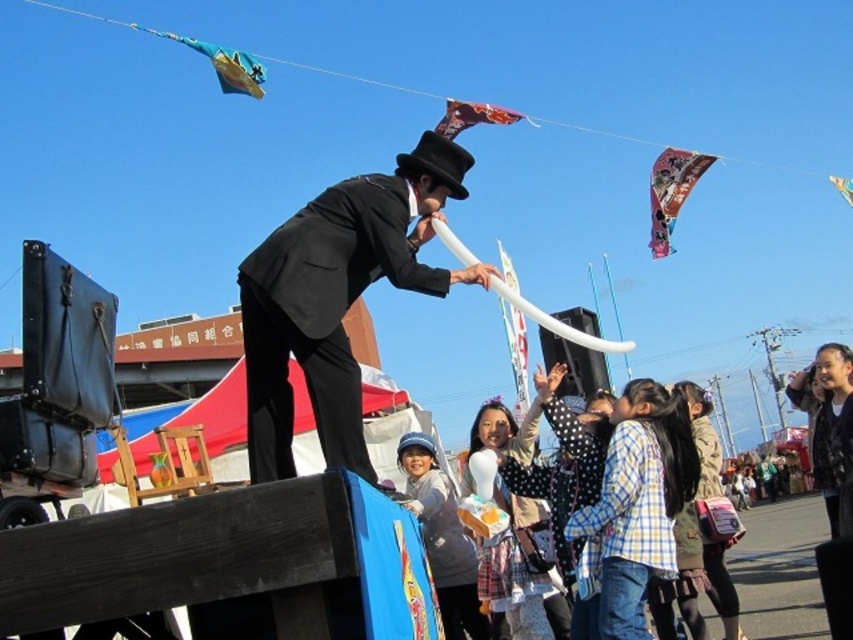
Based on the scene description, can you determine if the shiny black suit at center is positioned higher than the polka dot dress at lower right?

Yes, the shiny black suit at center is above the polka dot dress at lower right, so it is positioned higher.

You are a spectator at the event and want to know which kite is taller between the printed fabric kite at upper center and the metallic silver kite at upper right. Can you determine this based on their positions?

The printed fabric kite at upper center is taller than the metallic silver kite at upper right according to their positions in the scene.

You are a child in the crowd watching the performance. You want to know which kite is closer to you between the printed fabric kite at upper center and the metallic silver kite at upper right. Can you determine this based on their positions?

The printed fabric kite at upper center is closer to you than the metallic silver kite at upper right because it is positioned at upper center, while the metallic silver kite is at upper right.